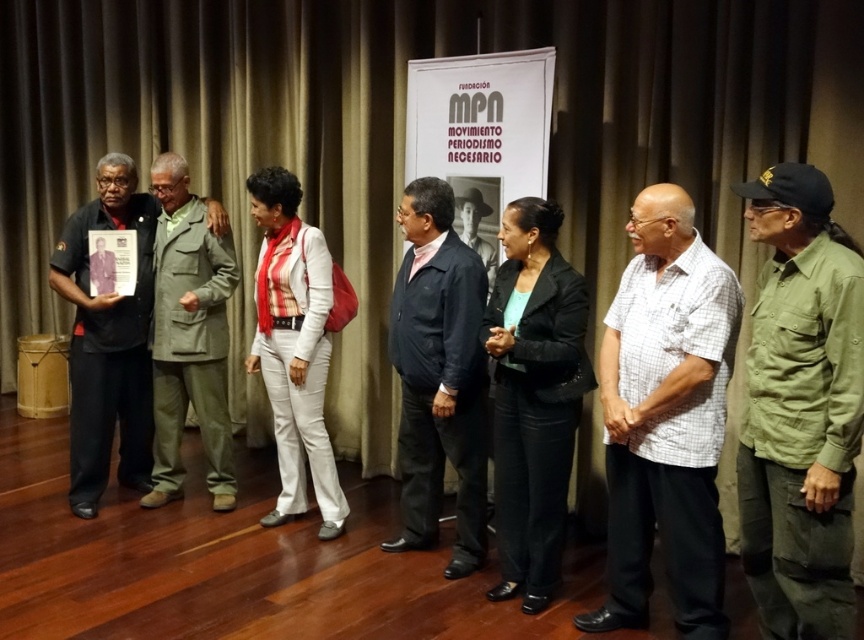
Between dark green uniform at left and khaki fabric suit at center, which one is positioned lower?

Positioned lower is khaki fabric suit at center.

Is point (68, 468) positioned after point (207, 477)?

Yes, point (68, 468) is farther from viewer.

Where is `dark green uniform at left`? dark green uniform at left is located at coordinates (108, 340).

This screenshot has width=864, height=640. I want to click on dark green uniform at left, so click(x=108, y=340).

Which is below, black matte blazer at center or matte black photo at left?

black matte blazer at center

Does black matte blazer at center have a greater height compared to matte black photo at left?

Correct, black matte blazer at center is much taller as matte black photo at left.

Find the location of a particular element. This screenshot has height=640, width=864. black matte blazer at center is located at coordinates (534, 396).

Who is higher up, white checkered shirt at center or matte black photo at left?

matte black photo at left is higher up.

Locate an element on the screen. The width and height of the screenshot is (864, 640). white checkered shirt at center is located at coordinates (665, 417).